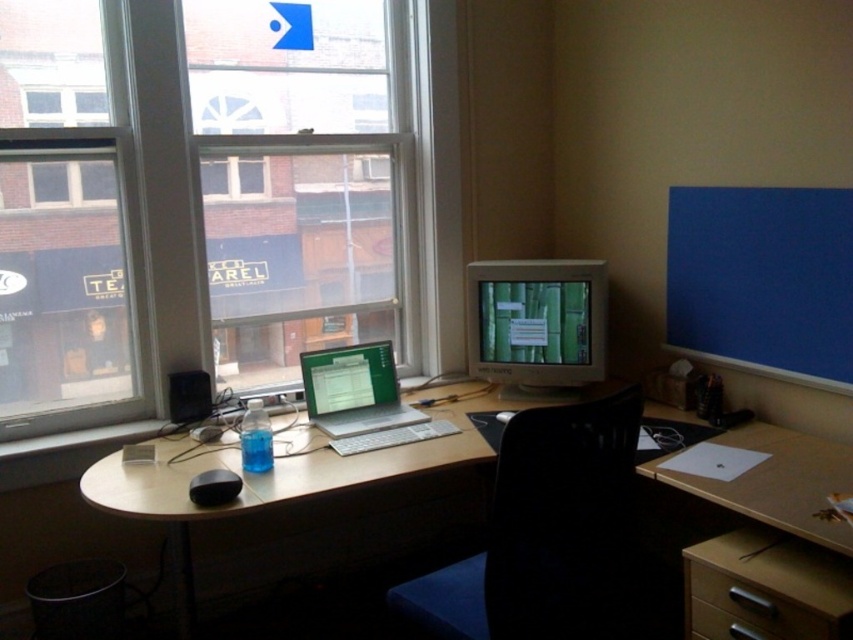
Consider the image. You are standing at the center of the room and want to sit down. Is the black plastic chair at center within reach from your current position?

The black plastic chair at center is located at point (544, 532), so yes, it is within reach from the center of the room.

You are sitting in the black plastic chair at center and want to reach the matte gray monitor at center to adjust its settings. Can you comfortably do this without moving your chair?

The black plastic chair at center is positioned under the matte gray monitor at center, so yes, you can comfortably adjust its settings without moving your chair since the chair is directly under the monitor.

From the picture: You are organizing your desk and want to place a new item between the wooden drawer at lower right and the satin silver laptop at center. Is there enough space for it?

The wooden drawer at lower right is positioned under the satin silver laptop at center, so there is vertical space between them where you can place the new item.